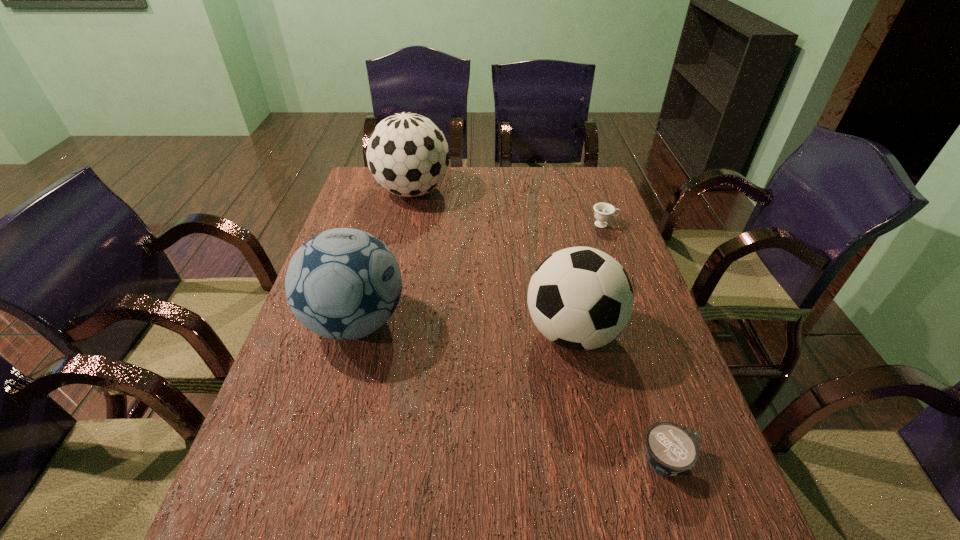
Where is `the closest object to the farthest soccer ball`? The height and width of the screenshot is (540, 960). the closest object to the farthest soccer ball is located at coordinates (343, 284).

Select which object appears as the closest to the rightmost soccer ball. Please provide its 2D coordinates. Your answer should be formatted as a tuple, i.e. [(x, y)], where the tuple contains the x and y coordinates of a point satisfying the conditions above.

[(671, 448)]

Identify the location of soccer ball that is the third closest to the yogurt. (408, 155).

Where is `soccer ball that is the third closest to the teacup`? soccer ball that is the third closest to the teacup is located at coordinates (343, 284).